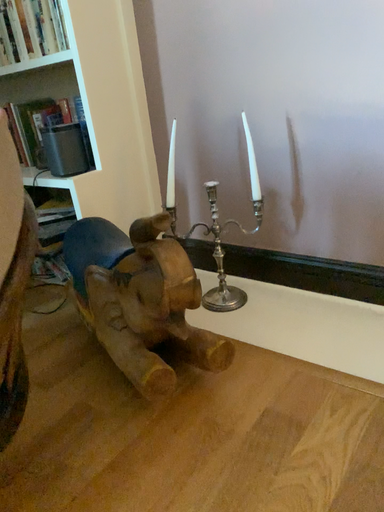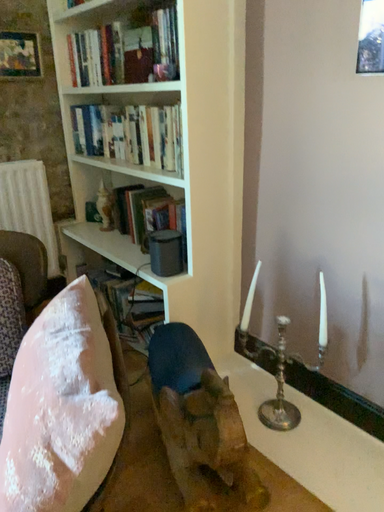
Question: How did the camera likely rotate when shooting the video?

Choices:
 (A) rotated right
 (B) rotated left

Answer: (B)